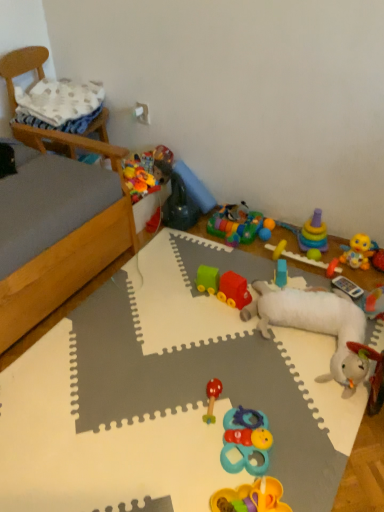
Find the location of a particular element. vacant space behind rubberized red mushroom at center, which is counted as the 2th toy, starting from the bottom is located at coordinates (210, 361).